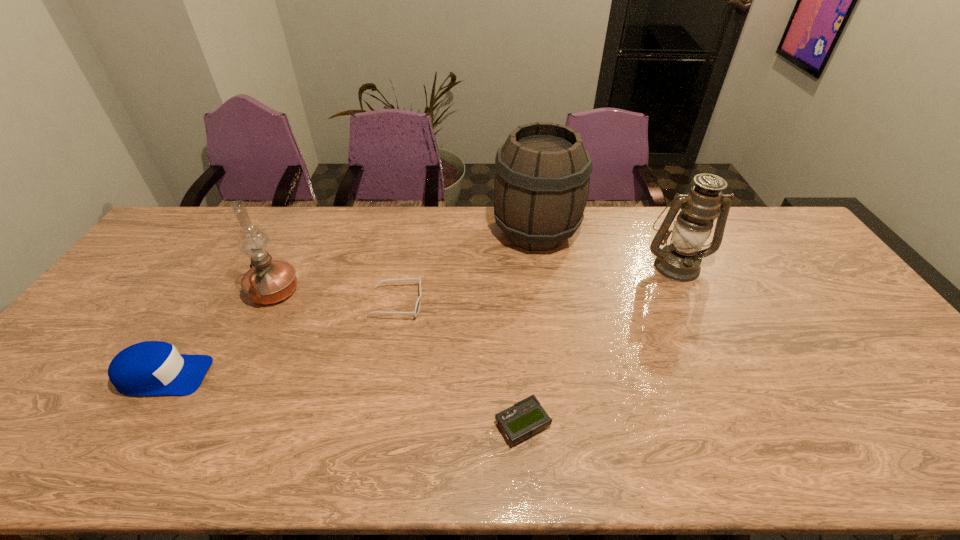
I want to click on vacant area located on the back of the rightmost object, so click(x=655, y=221).

Identify the location of free space located on the left of the left oil lamp. This screenshot has height=540, width=960. (199, 292).

You are a GUI agent. You are given a task and a screenshot of the screen. Output one action in this format:
    pyautogui.click(x=<x>, y=<y>)
    Task: Click on the free space located 0.220m on the front-facing side of the fifth farthest object
    This screenshot has height=540, width=960.
    Given the screenshot: What is the action you would take?
    pyautogui.click(x=296, y=376)

Image resolution: width=960 pixels, height=540 pixels. What are the coordinates of `vacant space located 0.330m with the lenses of the fourth object from right to left facing outward` in the screenshot? It's located at (536, 303).

This screenshot has height=540, width=960. Find the location of `vacant space located on the left of the nearest object`. vacant space located on the left of the nearest object is located at coordinates (368, 424).

Identify the location of object that is at the far edge. (542, 172).

Find the location of a particular element. object at the near edge is located at coordinates (525, 418).

In the image, there is a desktop. At what (x,y) coordinates should I click in order to perform the action: click on vacant space at the far edge. Please return your answer as a coordinate pair (x, y). The width and height of the screenshot is (960, 540). Looking at the image, I should click on (438, 239).

Where is `vacant space at the near edge`? Image resolution: width=960 pixels, height=540 pixels. vacant space at the near edge is located at coordinates (236, 453).

Identify the location of free space at the left edge of the desktop. The height and width of the screenshot is (540, 960). (78, 385).